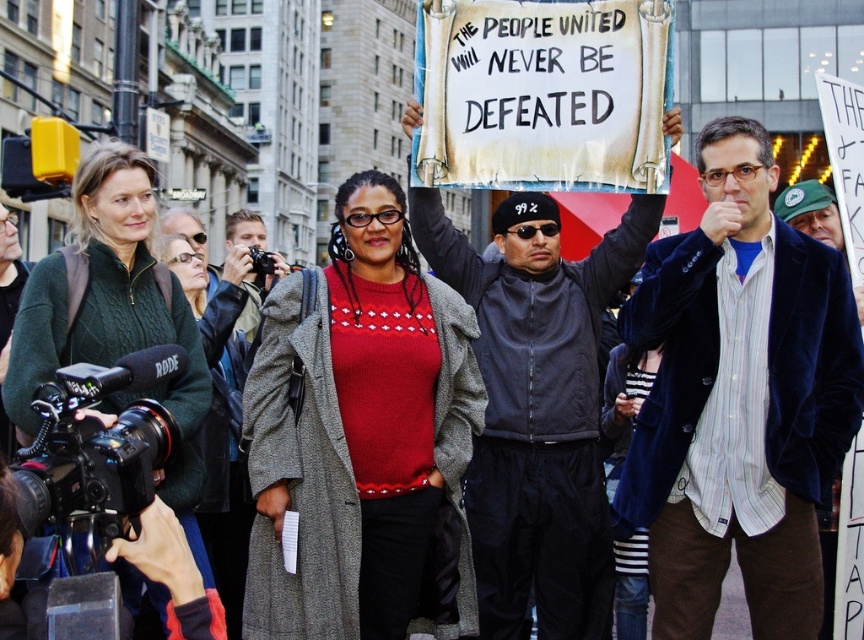
You are a photographer trying to capture the protest scene. You notice the knitted red sweater at center and the green knitted sweater at left. Which sweater is closer to the camera?

The knitted red sweater at center is closer to the camera because the green knitted sweater at left is behind it.

What is the spatial relationship between the green wool coat at left and the velvet blue blazer at upper right in terms of height?

The green wool coat at left is shorter than the velvet blue blazer at upper right.

You are a photographer trying to capture the protest scene. You notice the knitted red sweater at center and the velvet blue blazer at upper right. Which clothing item is located more to the left in the image?

The knitted red sweater at center is positioned on the left side of the velvet blue blazer at upper right, so it is more to the left.